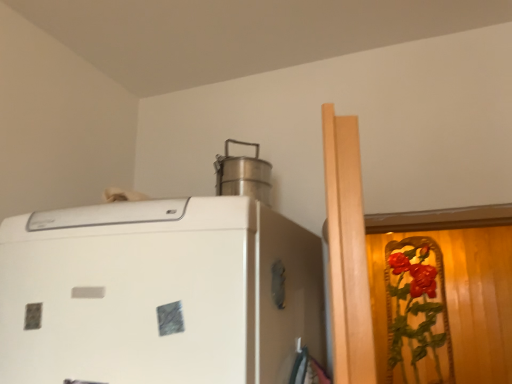
Find the location of `satin silver pot at upper center`. satin silver pot at upper center is located at coordinates (243, 174).

What do you see at coordinates (243, 174) in the screenshot? I see `satin silver pot at upper center` at bounding box center [243, 174].

Locate an element on the screen. The width and height of the screenshot is (512, 384). satin silver pot at upper center is located at coordinates (243, 174).